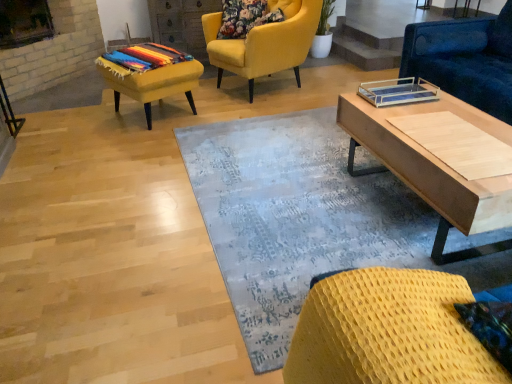
Question: Does blue textured rug at center lie behind multicolored woven blanket at left?

Choices:
 (A) yes
 (B) no

Answer: (B)

Question: Is multicolored woven blanket at left located within blue textured rug at center?

Choices:
 (A) yes
 (B) no

Answer: (B)

Question: Considering the relative sizes of blue textured rug at center and multicolored woven blanket at left in the image provided, is blue textured rug at center bigger than multicolored woven blanket at left?

Choices:
 (A) yes
 (B) no

Answer: (A)

Question: Is blue textured rug at center positioned with its back to multicolored woven blanket at left?

Choices:
 (A) yes
 (B) no

Answer: (B)

Question: Is blue textured rug at center located outside multicolored woven blanket at left?

Choices:
 (A) no
 (B) yes

Answer: (B)

Question: From the image's perspective, is blue textured rug at center above multicolored woven blanket at left?

Choices:
 (A) no
 (B) yes

Answer: (A)

Question: Does blue fabric couch at upper right, which ranks as the 3th chair in left-to-right order, turn towards velvet yellow armchair at upper center, the 3th chair viewed from the front?

Choices:
 (A) no
 (B) yes

Answer: (A)

Question: Does blue fabric couch at upper right, the 2th chair positioned from the back, come in front of velvet yellow armchair at upper center, the 3th chair viewed from the front?

Choices:
 (A) no
 (B) yes

Answer: (B)

Question: Can you confirm if blue fabric couch at upper right, positioned as the first chair in right-to-left order, is thinner than velvet yellow armchair at upper center, arranged as the 1th chair when viewed from the left?

Choices:
 (A) no
 (B) yes

Answer: (B)

Question: Is blue fabric couch at upper right, positioned as the first chair in right-to-left order, positioned behind velvet yellow armchair at upper center, arranged as the 1th chair when viewed from the left?

Choices:
 (A) yes
 (B) no

Answer: (B)

Question: Is blue fabric couch at upper right, the 2th chair positioned from the back, wider than velvet yellow armchair at upper center, the 3th chair from the right?

Choices:
 (A) yes
 (B) no

Answer: (B)

Question: Can you confirm if blue fabric couch at upper right, which ranks as the 3th chair in left-to-right order, is shorter than velvet yellow armchair at upper center, the 3th chair from the right?

Choices:
 (A) yes
 (B) no

Answer: (B)

Question: Can you confirm if velvet yellow armchair at upper center, the 3th chair viewed from the front, is bigger than light wood coffee table at right?

Choices:
 (A) yes
 (B) no

Answer: (A)